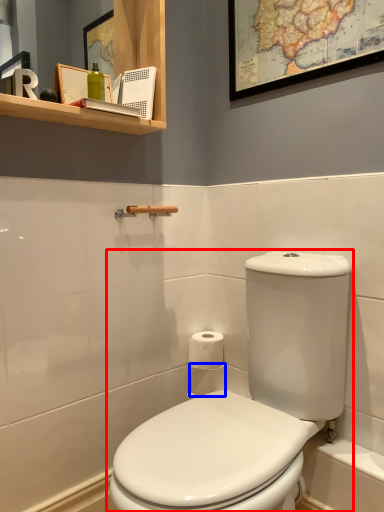
Question: Which of the following is the farthest to the observer, toilet (highlighted by a red box) or toilet paper (highlighted by a blue box)?

Choices:
 (A) toilet
 (B) toilet paper

Answer: (B)